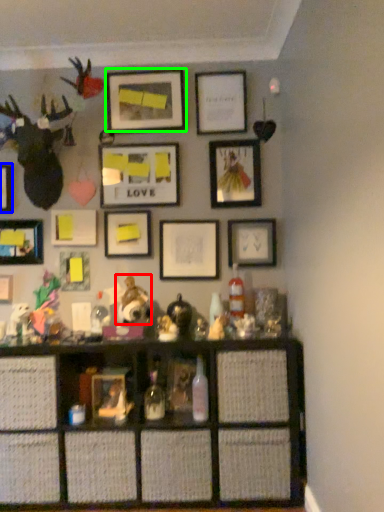
Question: Based on their relative distances, which object is farther from toy (highlighted by a red box)? Choose from picture frame (highlighted by a blue box) and picture frame (highlighted by a green box).

Choices:
 (A) picture frame
 (B) picture frame

Answer: (B)